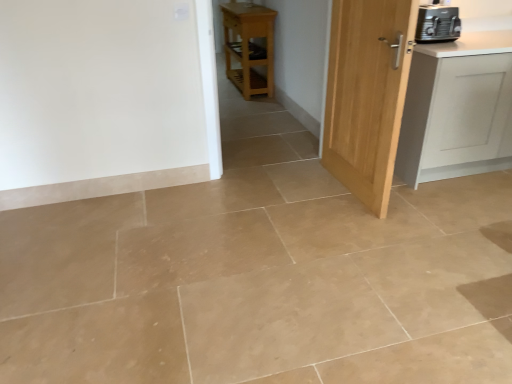
Question: Is light wood door at center right bigger than light wood/matte table at center?

Choices:
 (A) yes
 (B) no

Answer: (B)

Question: Does light wood door at center right touch light wood/matte table at center?

Choices:
 (A) yes
 (B) no

Answer: (B)

Question: Is light wood door at center right shorter than light wood/matte table at center?

Choices:
 (A) yes
 (B) no

Answer: (B)

Question: From the image's perspective, is light wood door at center right on top of light wood/matte table at center?

Choices:
 (A) no
 (B) yes

Answer: (A)

Question: Does light wood door at center right have a smaller size compared to light wood/matte table at center?

Choices:
 (A) yes
 (B) no

Answer: (A)

Question: In terms of width, does light wood/matte table at center look wider or thinner when compared to white matte cabinet at right?

Choices:
 (A) wide
 (B) thin

Answer: (B)

Question: Is light wood/matte table at center in front of or behind white matte cabinet at right in the image?

Choices:
 (A) front
 (B) behind

Answer: (B)

Question: Would you say light wood/matte table at center is to the left or to the right of white matte cabinet at right in the picture?

Choices:
 (A) left
 (B) right

Answer: (A)

Question: From a real-world perspective, is light wood/matte table at center above or below white matte cabinet at right?

Choices:
 (A) below
 (B) above

Answer: (A)

Question: From the image's perspective, relative to light wood door at center right, is white matte cabinet at right above or below?

Choices:
 (A) above
 (B) below

Answer: (A)

Question: From their relative heights in the image, would you say white matte cabinet at right is taller or shorter than light wood door at center right?

Choices:
 (A) tall
 (B) short

Answer: (B)

Question: In the image, is white matte cabinet at right positioned in front of or behind light wood door at center right?

Choices:
 (A) behind
 (B) front

Answer: (A)

Question: In terms of size, does white matte cabinet at right appear bigger or smaller than light wood door at center right?

Choices:
 (A) small
 (B) big

Answer: (B)

Question: Is black plastic toaster at upper right in front of or behind white matte cabinet at right in the image?

Choices:
 (A) behind
 (B) front

Answer: (A)

Question: Is black plastic toaster at upper right spatially inside white matte cabinet at right, or outside of it?

Choices:
 (A) outside
 (B) inside

Answer: (B)